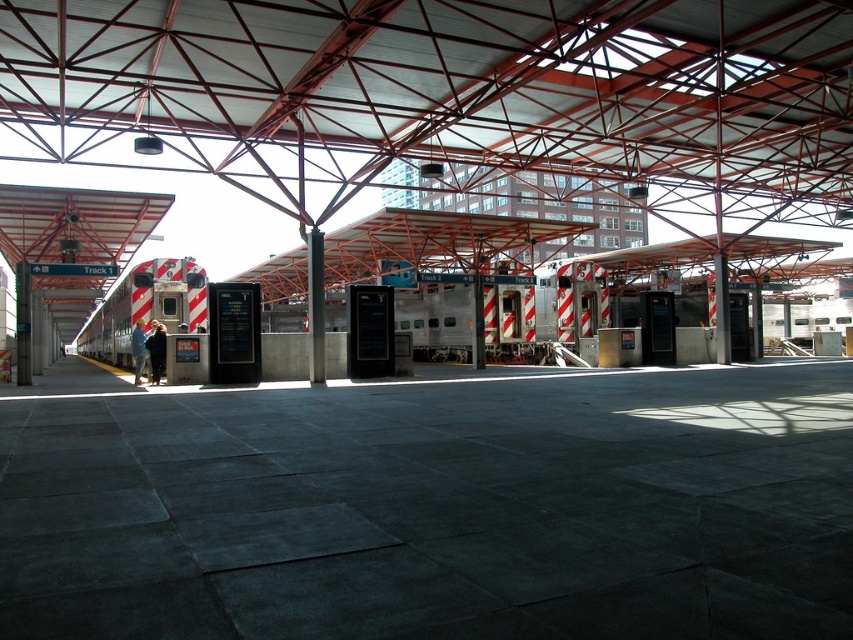
You are standing at the entrance of the train station platform. You need to board the silver metallic train at center. According to the platform layout, can you directly walk straight ahead from your current position to reach the train without needing to detour around any obstacles?

The silver metallic train at center is located at point (438,317), which is near the center of the platform. Since the platform is described as clean and spacious with a dark gray tiled surface, there are no mentioned obstacles blocking the path. Therefore, you can walk straight ahead to reach the silver metallic train at center without needing to detour.

You are a maintenance worker on the platform and need to inspect both the silver metallic train at center and the silver metallic train at left. If the train at center is larger, which one requires more time to inspect? Please explain based on their sizes.

The silver metallic train at center requires more time to inspect because it has a larger size compared to the silver metallic train at left.

You are a maintenance worker needing to move a 2.5 meter wide equipment cart from the right side of the platform to the left side. The path between the silver metallic train at center and the silver metallic train at left is narrow. Can you safely move the cart through this path without touching either train?

The path between the silver metallic train at center and the silver metallic train at left is narrow. Since the silver metallic train at center might be wider than the silver metallic train at left, the total width available for the cart may be insufficient. It is recommended to check the exact dimensions before attempting to move the cart through this path.